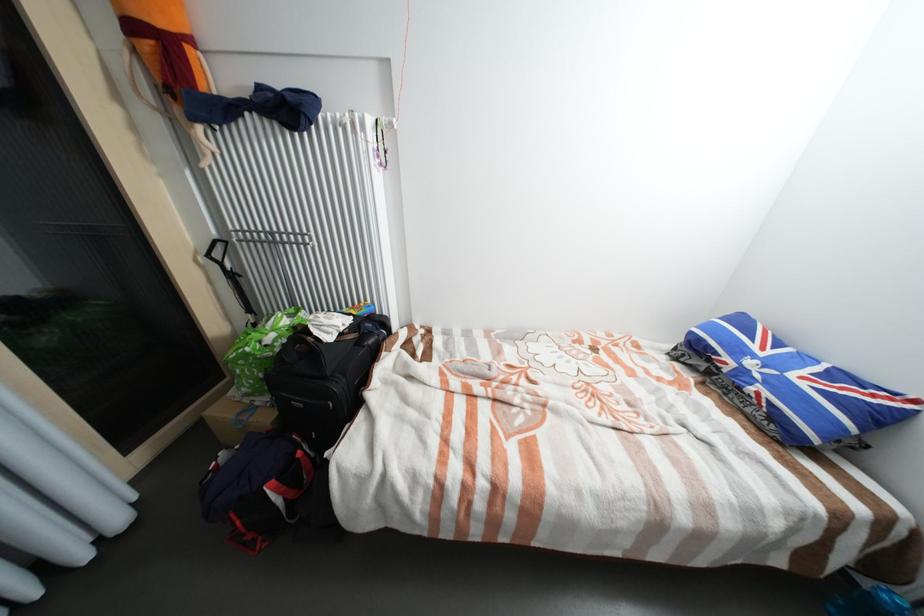
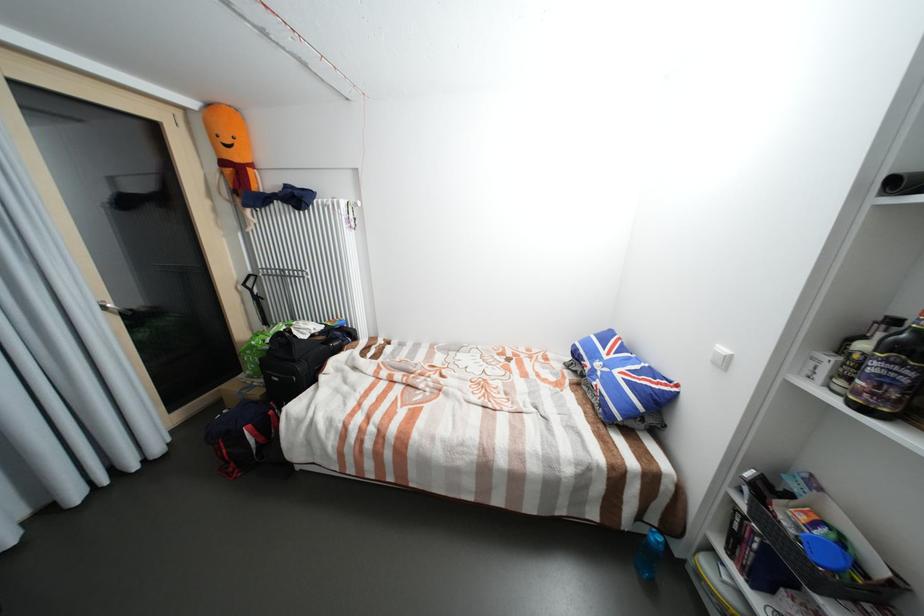
In the second image, find the point that corresponds to point 337,326 in the first image.

(313, 330)